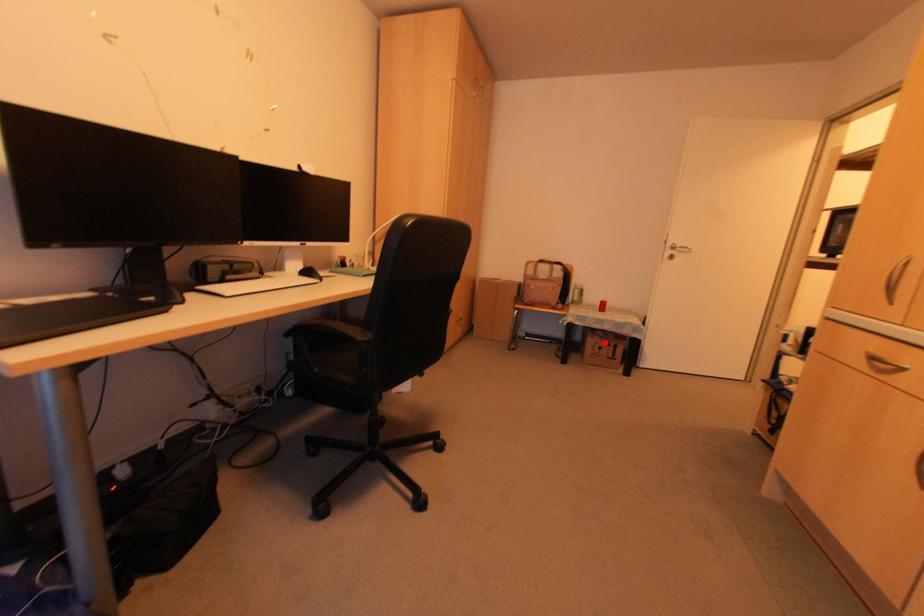
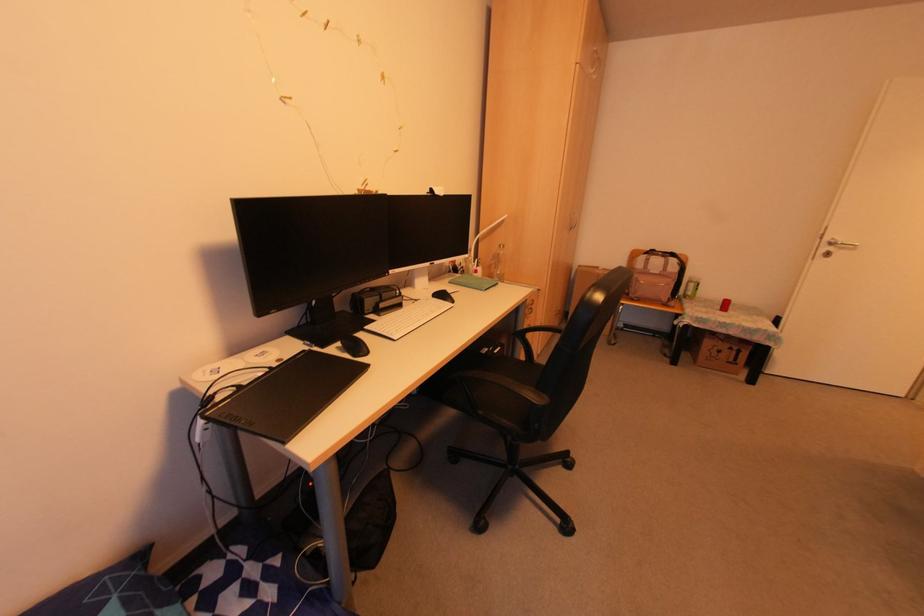
Question: A red point is marked in image1. In image2, is the corresponding 3D point closer to the camera or farther? Reply with the corresponding letter.

Choices:
 (A) The corresponding 3D point is closer.
 (B) The corresponding 3D point is farther.

Answer: (B)